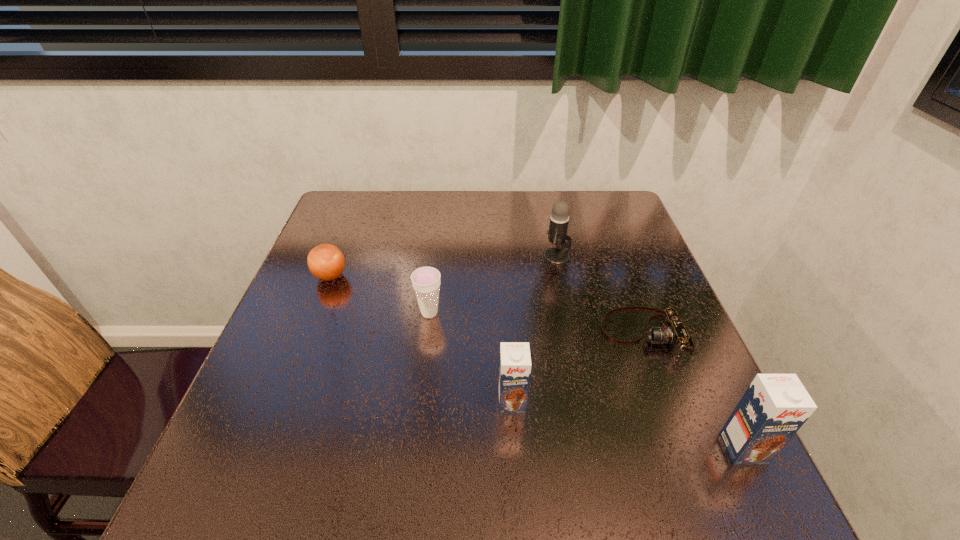
This screenshot has width=960, height=540. What are the coordinates of `vacant spot to place a chocolate milk on the left` in the screenshot? It's located at (316, 363).